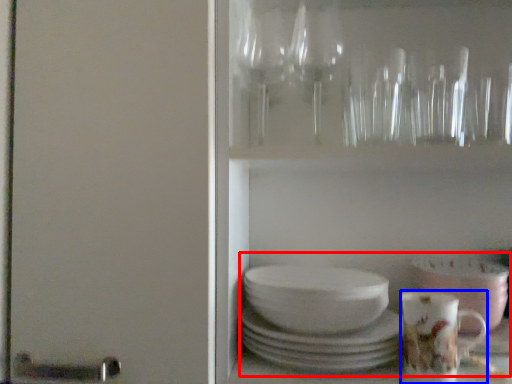
Question: Which object is further to the camera taking this photo, tea set (highlighted by a red box) or coffee cup (highlighted by a blue box)?

Choices:
 (A) tea set
 (B) coffee cup

Answer: (B)